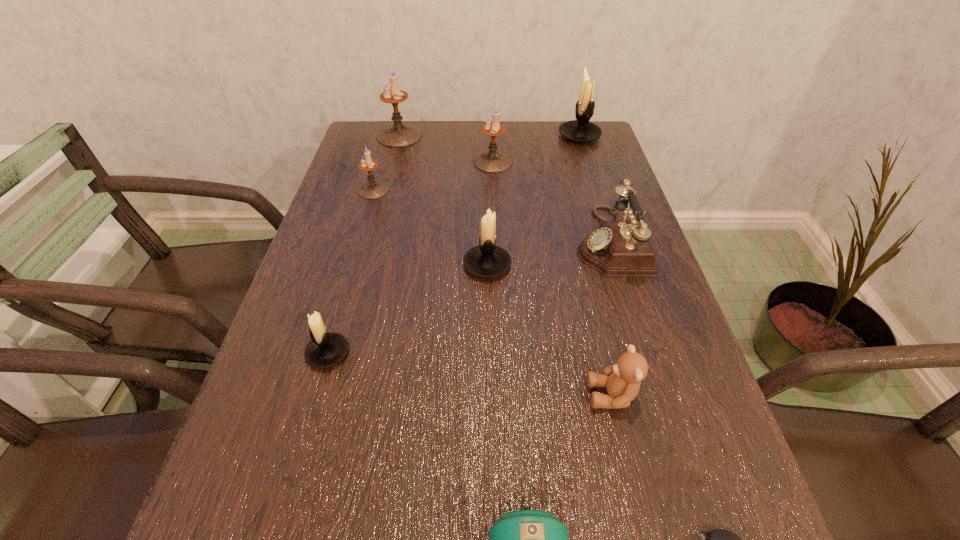
Choose which white candle holder is the second nearest neighbor to the computer mouse. Please provide its 2D coordinates. Your answer should be formatted as a tuple, i.e. [(x, y)], where the tuple contains the x and y coordinates of a point satisfying the conditions above.

[(325, 350)]

Locate an element on the screen. vacant space that satisfies the following two spatial constraints: 1. on the dial of the black telephone; 2. on the front side of the leftmost white candle holder is located at coordinates (644, 353).

Find the location of a particular element. vacant region that satisfies the following two spatial constraints: 1. on the back side of the second nearest candle holder; 2. on the left side of the biggest white candle holder is located at coordinates (485, 136).

At what (x,y) coordinates should I click in order to perform the action: click on vacant area in the image that satisfies the following two spatial constraints: 1. on the back side of the leftmost white candle holder; 2. on the left side of the third farthest object. Please return your answer as a coordinate pair (x, y). The height and width of the screenshot is (540, 960). Looking at the image, I should click on (382, 162).